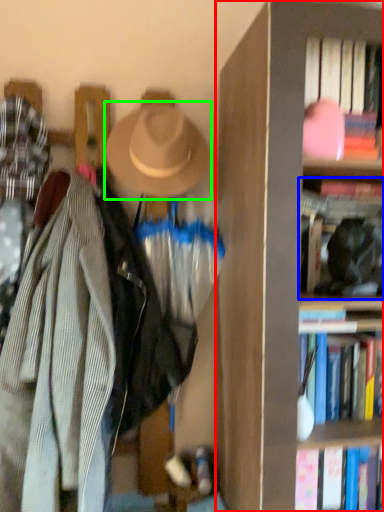
Question: Which object is the farthest from bookcase (highlighted by a red box)? Choose among these: book (highlighted by a blue box) or hat (highlighted by a green box).

Choices:
 (A) book
 (B) hat

Answer: (B)